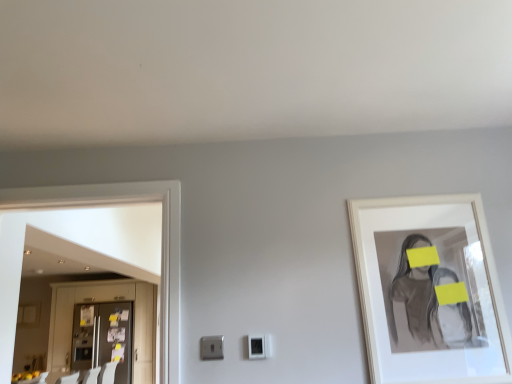
Locate an element on the screen. This screenshot has height=384, width=512. white matte picture frame at upper right is located at coordinates (429, 290).

Describe the element at coordinates (257, 346) in the screenshot. The height and width of the screenshot is (384, 512). I see `white plastic electric outlet at center` at that location.

I want to click on white matte picture frame at upper right, so click(429, 290).

Does point (490, 333) come farther from viewer compared to point (108, 319)?

No, it is not.

From the image's perspective, is white matte picture frame at upper right on metallic refrigerator at left?

Yes.

From a real-world perspective, who is located lower, white matte picture frame at upper right or metallic refrigerator at left?

From a 3D spatial view, metallic refrigerator at left is below.

Does white matte picture frame at upper right have a smaller size compared to metallic refrigerator at left?

Yes.

Is matte gray cabinetry at left next to metallic refrigerator at left?

matte gray cabinetry at left and metallic refrigerator at left are clearly separated.

Who is shorter, matte gray cabinetry at left or metallic refrigerator at left?

With less height is metallic refrigerator at left.

Which point is more distant from viewer, (108, 291) or (129, 305)?

The point (108, 291) is farther from the camera.

Is matte gray cabinetry at left to the right of metallic refrigerator at left from the viewer's perspective?

In fact, matte gray cabinetry at left is to the left of metallic refrigerator at left.

Does white matte picture frame at upper right come behind matte gray cabinetry at left?

No.

From the image's perspective, would you say white matte picture frame at upper right is shown under matte gray cabinetry at left?

No, from the image's perspective, white matte picture frame at upper right is not beneath matte gray cabinetry at left.

Is white matte picture frame at upper right oriented towards matte gray cabinetry at left?

No, white matte picture frame at upper right does not turn towards matte gray cabinetry at left.

Is white matte picture frame at upper right wider or thinner than matte gray cabinetry at left?

Considering their sizes, white matte picture frame at upper right looks slimmer than matte gray cabinetry at left.

From the image's perspective, who appears lower, white plastic electric outlet at center or white matte picture frame at upper right?

white plastic electric outlet at center appears lower in the image.

In the image, there is a white plastic electric outlet at center. Identify the location of picture frame above it (from the image's perspective). tap(429, 290).

Is white matte picture frame at upper right located within white plastic electric outlet at center?

No, white plastic electric outlet at center does not contain white matte picture frame at upper right.

How different are the orientations of white plastic electric outlet at center and white matte picture frame at upper right in degrees?

2.18 degrees.

Is matte gray cabinetry at left not near white plastic electric outlet at center?

matte gray cabinetry at left is far away from white plastic electric outlet at center.

Based on their sizes in the image, would you say matte gray cabinetry at left is bigger or smaller than white plastic electric outlet at center?

Clearly, matte gray cabinetry at left is larger in size than white plastic electric outlet at center.

Is point (147, 367) closer to viewer compared to point (251, 342)?

No, (147, 367) is further to viewer.

Considering the relative positions of matte gray cabinetry at left and white plastic electric outlet at center in the image provided, is matte gray cabinetry at left to the left of white plastic electric outlet at center from the viewer's perspective?

Yes, matte gray cabinetry at left is to the left of white plastic electric outlet at center.

Between metallic refrigerator at left and matte gray cabinetry at left, which one has smaller width?

matte gray cabinetry at left.

From the image's perspective, is metallic refrigerator at left beneath matte gray cabinetry at left?

Yes.

Can you confirm if metallic refrigerator at left is taller than matte gray cabinetry at left?

No, metallic refrigerator at left is not taller than matte gray cabinetry at left.

Identify the location of door on the right of matte gray cabinetry at left. (103, 337).

Are white plastic electric outlet at center and matte gray cabinetry at left far apart?

Absolutely, white plastic electric outlet at center is distant from matte gray cabinetry at left.

Is white plastic electric outlet at center turned away from matte gray cabinetry at left?

No, white plastic electric outlet at center is not facing away from matte gray cabinetry at left.

In the image, is white plastic electric outlet at center positioned in front of or behind matte gray cabinetry at left?

Clearly, white plastic electric outlet at center is in front of matte gray cabinetry at left.

Between white plastic electric outlet at center and matte gray cabinetry at left, which one has less height?

white plastic electric outlet at center.

In order to click on picture frame above the metallic refrigerator at left (from a real-world perspective) in this screenshot , I will do `click(429, 290)`.

The width and height of the screenshot is (512, 384). I want to click on door that appears below the matte gray cabinetry at left (from the image's perspective), so (103, 337).

Looking at the image, which one is located further to metallic refrigerator at left, white matte picture frame at upper right or matte gray cabinetry at left?

The object further to metallic refrigerator at left is white matte picture frame at upper right.

When comparing their distances from white plastic electric outlet at center, does white matte picture frame at upper right or matte gray cabinetry at left seem further?

matte gray cabinetry at left lies further to white plastic electric outlet at center than the other object.

From the image, which object appears to be farther from matte gray cabinetry at left, metallic refrigerator at left or white matte picture frame at upper right?

white matte picture frame at upper right.

Based on the photo, considering their positions, is white plastic electric outlet at center positioned closer to matte gray cabinetry at left than metallic refrigerator at left?

metallic refrigerator at left is positioned closer to the anchor matte gray cabinetry at left.

When comparing their distances from matte gray cabinetry at left, does white plastic electric outlet at center or white matte picture frame at upper right seem further?

white plastic electric outlet at center lies further to matte gray cabinetry at left than the other object.

Estimate the real-world distances between objects in this image. Which object is closer to metallic refrigerator at left, white plastic electric outlet at center or matte gray cabinetry at left?

Based on the image, matte gray cabinetry at left appears to be nearer to metallic refrigerator at left.

From the image, which object appears to be farther from matte gray cabinetry at left, white matte picture frame at upper right or white plastic electric outlet at center?

Based on the image, white plastic electric outlet at center appears to be further to matte gray cabinetry at left.

When comparing their distances from metallic refrigerator at left, does white plastic electric outlet at center or white matte picture frame at upper right seem further?

Among the two, white matte picture frame at upper right is located further to metallic refrigerator at left.

Locate an element on the screen. This screenshot has width=512, height=384. door located between white matte picture frame at upper right and matte gray cabinetry at left in the depth direction is located at coordinates (103, 337).

At what (x,y) coordinates should I click in order to perform the action: click on door between white plastic electric outlet at center and matte gray cabinetry at left along the z-axis. Please return your answer as a coordinate pair (x, y). This screenshot has height=384, width=512. Looking at the image, I should click on (103, 337).

Where is `electric outlet positioned between white matte picture frame at upper right and matte gray cabinetry at left from near to far`? electric outlet positioned between white matte picture frame at upper right and matte gray cabinetry at left from near to far is located at coordinates (257, 346).

This screenshot has width=512, height=384. Identify the location of electric outlet between white matte picture frame at upper right and metallic refrigerator at left in the front-back direction. (257, 346).